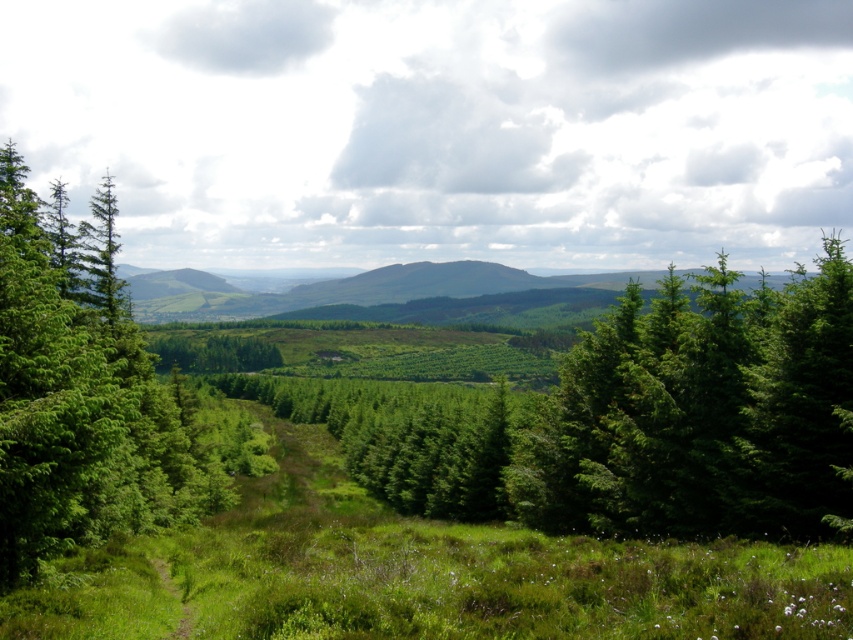
You are an explorer navigating through the landscape. You see the green matte tree at center and the green leafy tree at left. Which tree is located to the left of the other?

The green leafy tree at left is positioned to the left of the green matte tree at center.

You are standing in the landscape and want to walk from the point at coordinates point (619, 358) to the point at coordinates point (13, 147). Since you can only move forward, will you be moving towards the foreground or the background?

Since point (619, 358) is closer to the camera than point (13, 147), moving from point (619, 358) to point (13, 147) means you are moving away from the foreground towards the background.